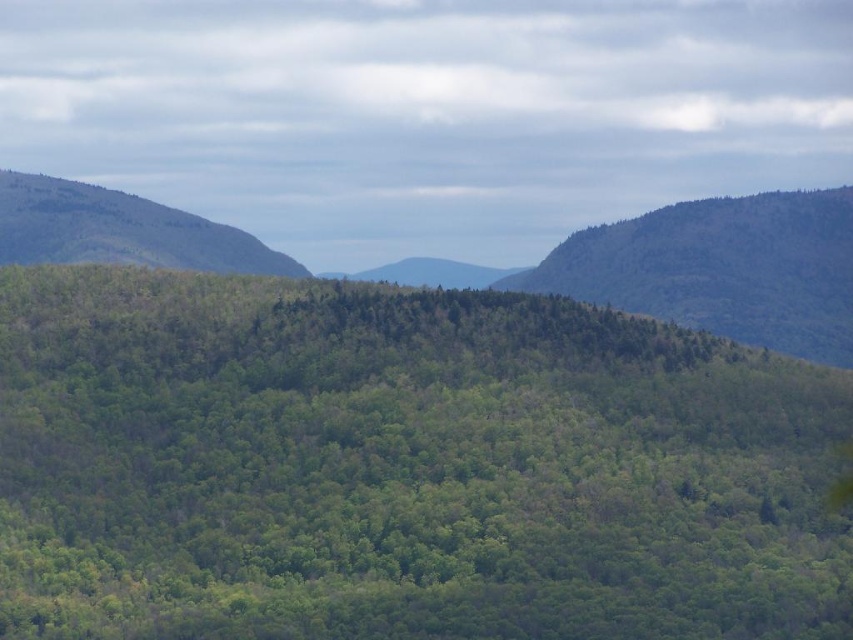
Describe the element at coordinates (721, 268) in the screenshot. This screenshot has width=853, height=640. I see `green leafy hill at right` at that location.

Is point (837, 348) more distant than point (0, 260)?

Yes.

In order to click on green leafy hill at right in this screenshot , I will do `click(721, 268)`.

Find the location of a particular element. This screenshot has height=640, width=853. green leafy hill at right is located at coordinates (721, 268).

Does green forested mountain at center have a smaller size compared to green leafy hillside at left?

No, green forested mountain at center is not smaller than green leafy hillside at left.

Who is positioned more to the right, green forested mountain at center or green leafy hillside at left?

green forested mountain at center is more to the right.

The height and width of the screenshot is (640, 853). In order to click on green forested mountain at center in this screenshot , I will do `click(722, 268)`.

Who is more distant from viewer, (171, 216) or (844, 300)?

Point (844, 300)

Find the location of a particular element. green forested mountain at center is located at coordinates (722, 268).

Where is `green forested mountain at center`? The width and height of the screenshot is (853, 640). green forested mountain at center is located at coordinates (722, 268).

You are a GUI agent. You are given a task and a screenshot of the screen. Output one action in this format:
    pyautogui.click(x=<x>, y=<y>)
    Task: Click on the green forested mountain at center
    The height and width of the screenshot is (640, 853).
    Given the screenshot: What is the action you would take?
    pyautogui.click(x=722, y=268)